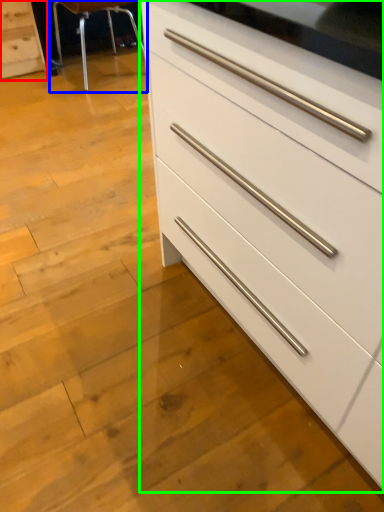
Question: Which object is positioned farthest from chest of drawers (highlighted by a red box)? Select from bar stool (highlighted by a blue box) and chest of drawers (highlighted by a green box).

Choices:
 (A) bar stool
 (B) chest of drawers

Answer: (B)